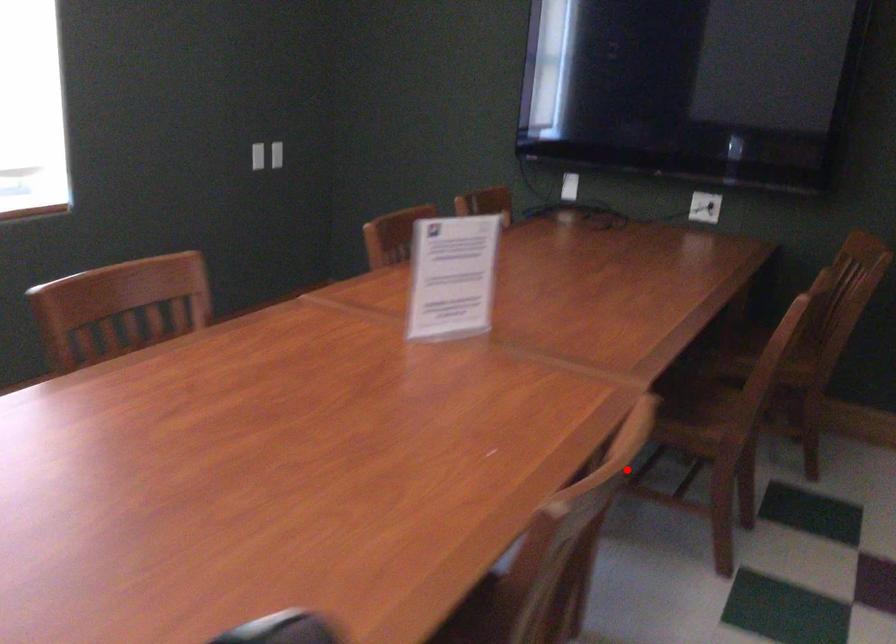
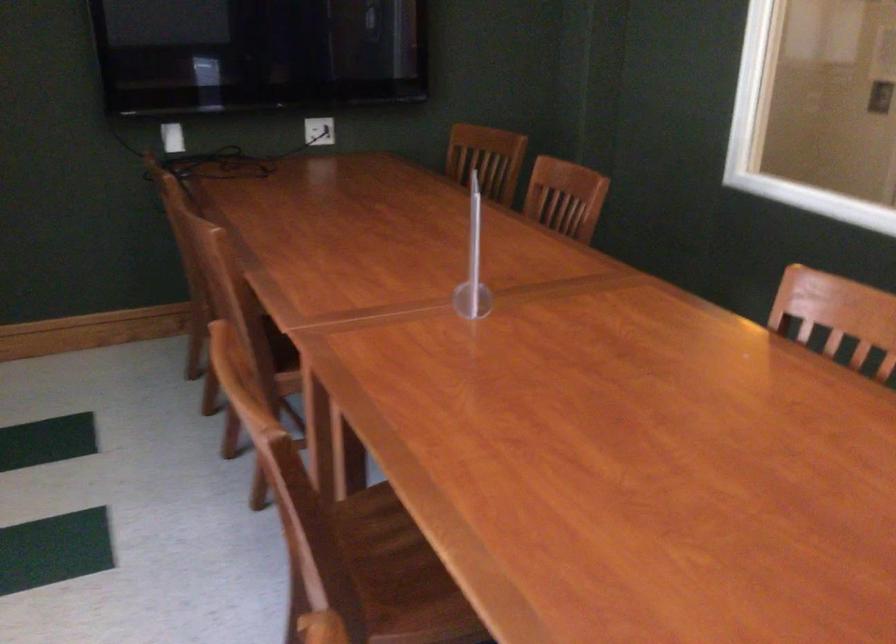
Question: I am providing you with two images of the same scene from different viewpoints. A red point is shown in image1. For the corresponding object point in image2, is it positioned nearer or farther from the camera?

Choices:
 (A) Nearer
 (B) Farther

Answer: (B)